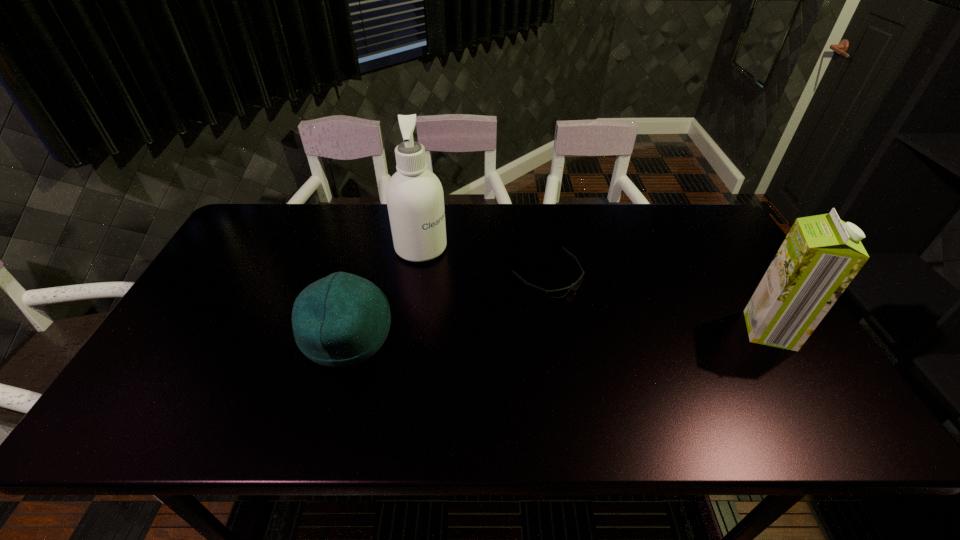
I want to click on vacant area between the cleansing agent and the sunglasses, so click(x=484, y=262).

You are a GUI agent. You are given a task and a screenshot of the screen. Output one action in this format:
    pyautogui.click(x=<x>, y=<y>)
    Task: Click on the vacant space that's between the soya milk and the tallest object
    
    Given the screenshot: What is the action you would take?
    pyautogui.click(x=595, y=289)

Where is `vacant area between the cleansing agent and the beanie`? This screenshot has height=540, width=960. vacant area between the cleansing agent and the beanie is located at coordinates (384, 292).

Choose which object is the nearest neighbor to the soya milk. Please provide its 2D coordinates. Your answer should be formatted as a tuple, i.e. [(x, y)], where the tuple contains the x and y coordinates of a point satisfying the conditions above.

[(558, 293)]

Find the location of a particular element. Image resolution: width=960 pixels, height=540 pixels. object that is the nearest to the cleansing agent is located at coordinates (341, 320).

Locate an element on the screen. The height and width of the screenshot is (540, 960). vacant region that satisfies the following two spatial constraints: 1. on the back side of the second shortest object; 2. on the right side of the tallest object is located at coordinates (372, 248).

Locate an element on the screen. vacant space that satisfies the following two spatial constraints: 1. on the back side of the beanie; 2. on the left side of the shortest object is located at coordinates (364, 276).

Where is `free spot that satisfies the following two spatial constraints: 1. on the back side of the third shortest object; 2. on the right side of the third tallest object`? Image resolution: width=960 pixels, height=540 pixels. free spot that satisfies the following two spatial constraints: 1. on the back side of the third shortest object; 2. on the right side of the third tallest object is located at coordinates (348, 330).

Locate an element on the screen. The image size is (960, 540). vacant region that satisfies the following two spatial constraints: 1. on the back side of the second tallest object; 2. on the left side of the beanie is located at coordinates (348, 330).